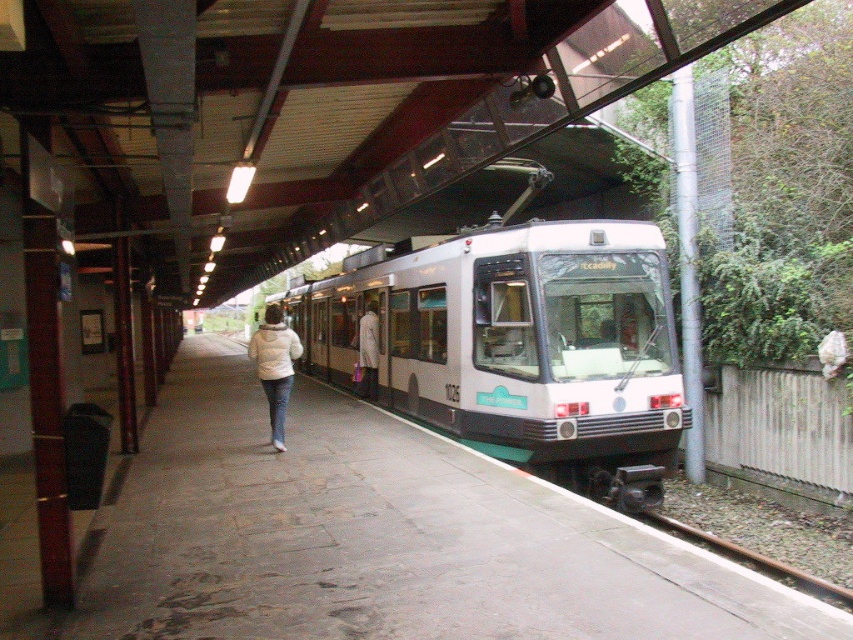
Question: Considering the real-world distances, which object is closest to the brown metal train track at lower right?

Choices:
 (A) concrete platform at center
 (B) white matte coat at center

Answer: (A)

Question: Which object appears farthest from the camera in this image?

Choices:
 (A) concrete platform at center
 (B) white fleece jacket at center
 (C) white matte coat at center
 (D) white glossy train at center

Answer: (C)

Question: Estimate the real-world distances between objects in this image. Which object is closer to the white matte coat at center?

Choices:
 (A) concrete platform at center
 (B) white fleece jacket at center

Answer: (A)

Question: Does concrete platform at center appear under brown metal train track at lower right?

Choices:
 (A) no
 (B) yes

Answer: (A)

Question: Does white glossy train at center have a lesser width compared to brown metal train track at lower right?

Choices:
 (A) yes
 (B) no

Answer: (B)

Question: Does concrete platform at center have a greater width compared to brown metal train track at lower right?

Choices:
 (A) no
 (B) yes

Answer: (B)